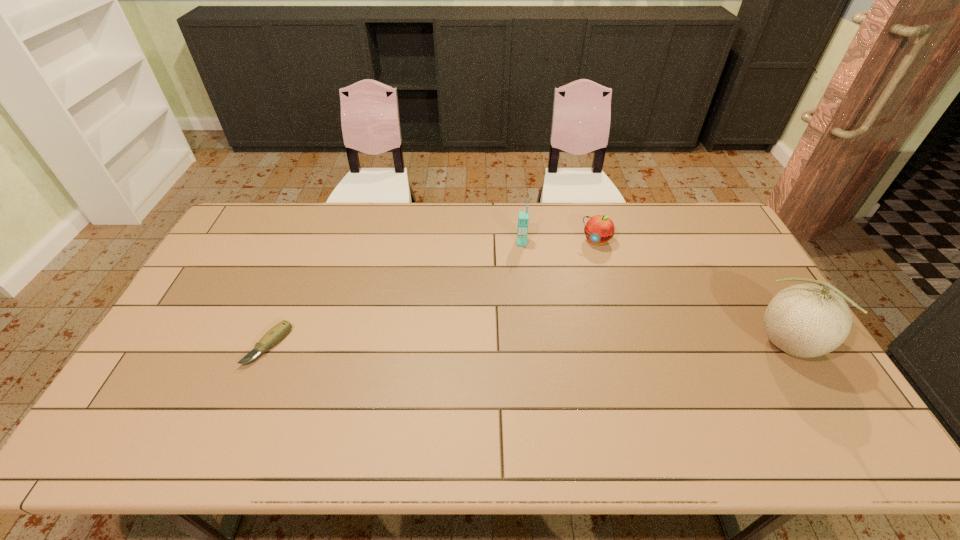
Locate an element on the screen. Image resolution: width=960 pixels, height=540 pixels. the shortest object is located at coordinates (278, 332).

Locate an element on the screen. This screenshot has height=540, width=960. the leftmost object is located at coordinates (278, 332).

Locate an element on the screen. This screenshot has height=540, width=960. cantaloup is located at coordinates (806, 320).

What are the coordinates of `the tallest object` in the screenshot? It's located at (806, 320).

This screenshot has height=540, width=960. In order to click on cellular telephone in this screenshot , I will do `click(523, 218)`.

At what (x,y) coordinates should I click in order to perform the action: click on the third object from right to left. Please return your answer as a coordinate pair (x, y). The height and width of the screenshot is (540, 960). Looking at the image, I should click on (523, 218).

Image resolution: width=960 pixels, height=540 pixels. What are the coordinates of `apple` in the screenshot? It's located at coord(599,229).

Locate an element on the screen. the second shortest object is located at coordinates (599, 229).

I want to click on free space located 0.370m on the right of the pocketknife, so click(x=420, y=346).

Where is `free space located 0.240m on the left of the tallest object`? This screenshot has width=960, height=540. free space located 0.240m on the left of the tallest object is located at coordinates click(670, 346).